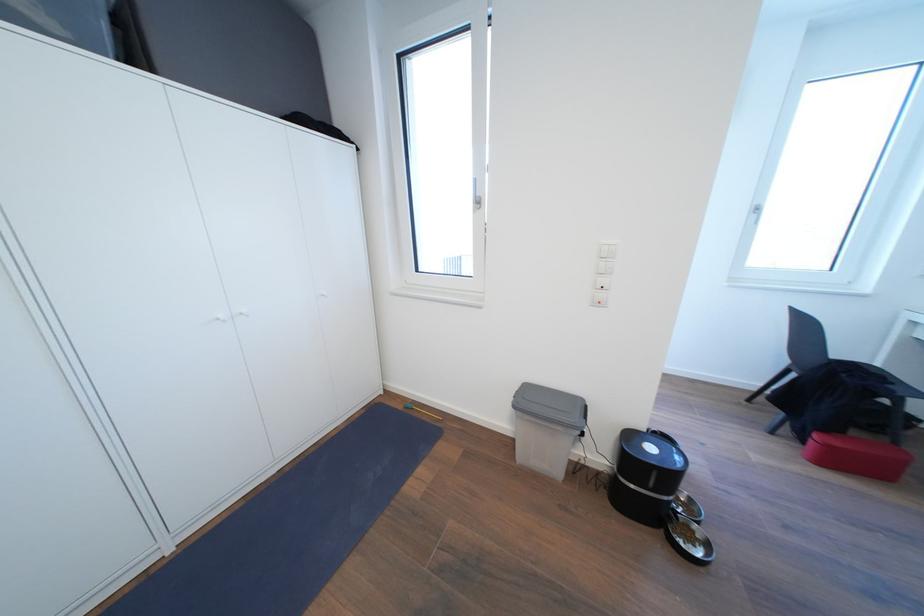
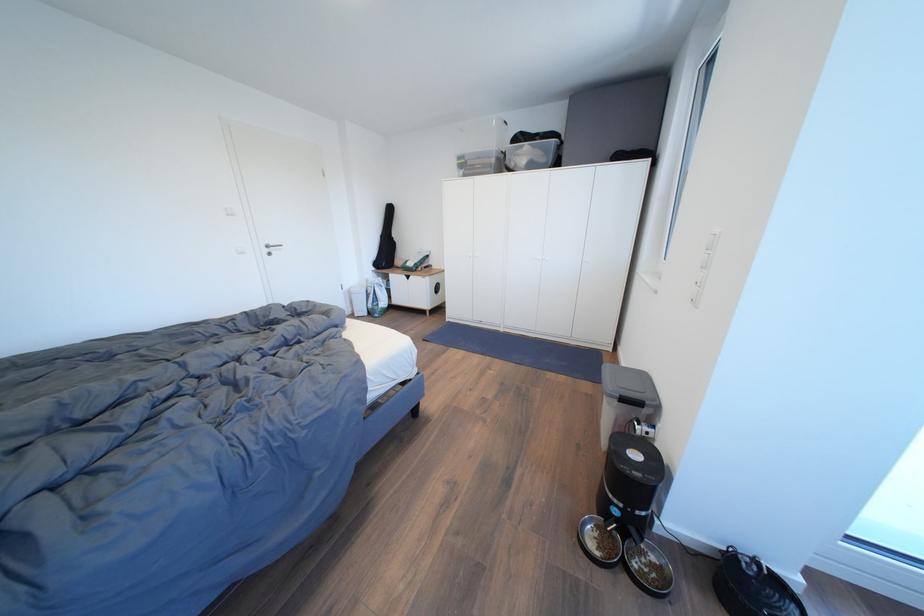
Question: I am providing you with two images of the same scene from different viewpoints. Which of the following objects are not visible in image2?

Choices:
 (A) metal cabinet handle
 (B) pet feeder lid
 (C) silver door handle
 (D) none of these

Answer: (D)